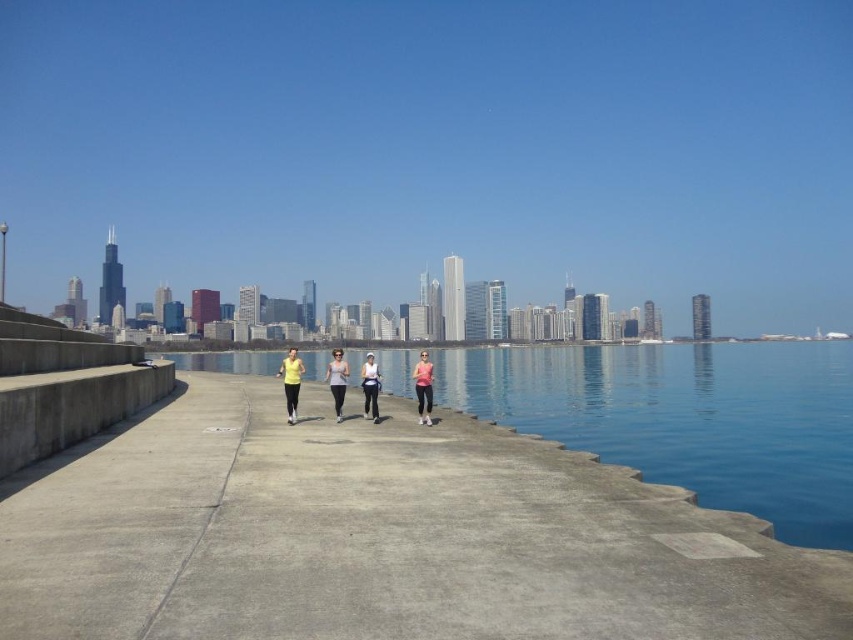
Question: In this image, where is blue water at center located relative to pink matte tank top at center?

Choices:
 (A) left
 (B) right

Answer: (B)

Question: Observing the image, what is the correct spatial positioning of matte yellow shirt at center in reference to matte white tank top at center?

Choices:
 (A) left
 (B) right

Answer: (A)

Question: Does blue water at center appear over pink matte tank top at center?

Choices:
 (A) no
 (B) yes

Answer: (A)

Question: Which point appears closest to the camera in this image?

Choices:
 (A) (373, 420)
 (B) (341, 376)

Answer: (A)

Question: Which of the following is the closest to the observer?

Choices:
 (A) (339, 353)
 (B) (660, 406)

Answer: (A)

Question: Which point is closer to the camera taking this photo?

Choices:
 (A) (334, 376)
 (B) (822, 500)
 (C) (363, 413)
 (D) (364, 401)

Answer: (B)